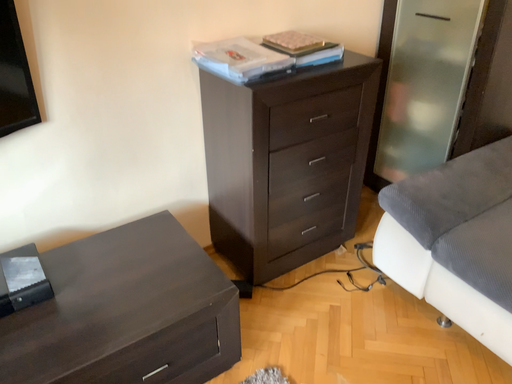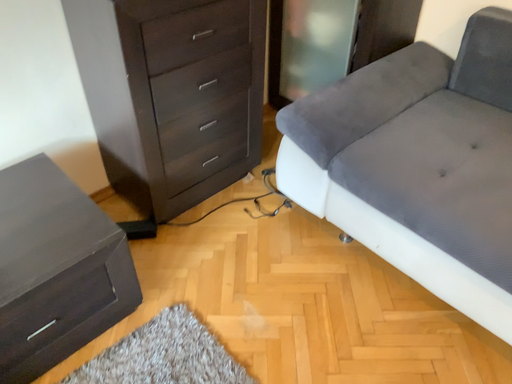
Question: Which way did the camera rotate in the video?

Choices:
 (A) rotated left
 (B) rotated right

Answer: (B)